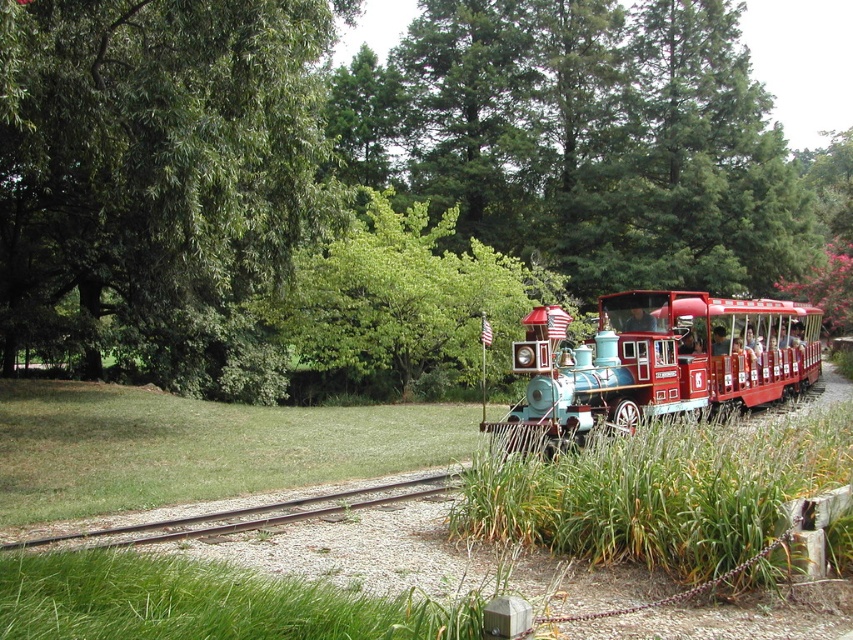
Question: Which object appears closest to the camera in this image?

Choices:
 (A) blue metallic train at center
 (B) shiny red train at right
 (C) brown gravel track at lower center
 (D) green leafy tree at center

Answer: (A)

Question: Is green leafy tree at upper left behind shiny red train at right?

Choices:
 (A) yes
 (B) no

Answer: (B)

Question: Does green leafy tree at upper left have a lesser width compared to brown gravel track at lower center?

Choices:
 (A) yes
 (B) no

Answer: (B)

Question: Which is farther from the blue metallic train at center?

Choices:
 (A) green leafy tree at center
 (B) green leafy tree at upper left
 (C) shiny red train at right
 (D) brown gravel track at lower center

Answer: (A)

Question: From the image, what is the correct spatial relationship of shiny red train at right in relation to brown gravel track at lower center?

Choices:
 (A) below
 (B) above

Answer: (B)

Question: Among these objects, which one is nearest to the camera?

Choices:
 (A) green leafy tree at upper left
 (B) green leafy tree at center
 (C) blue metallic train at center

Answer: (C)